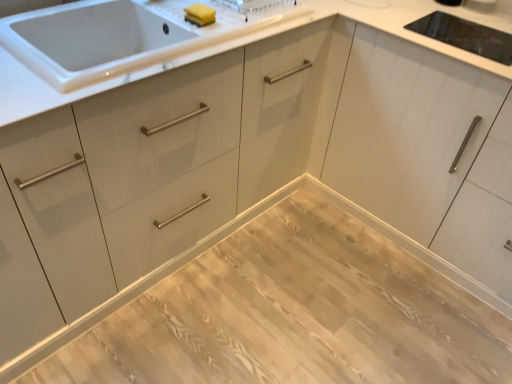
In order to click on vacant space to the right of yellow sponge at upper center in this screenshot , I will do pyautogui.click(x=234, y=28).